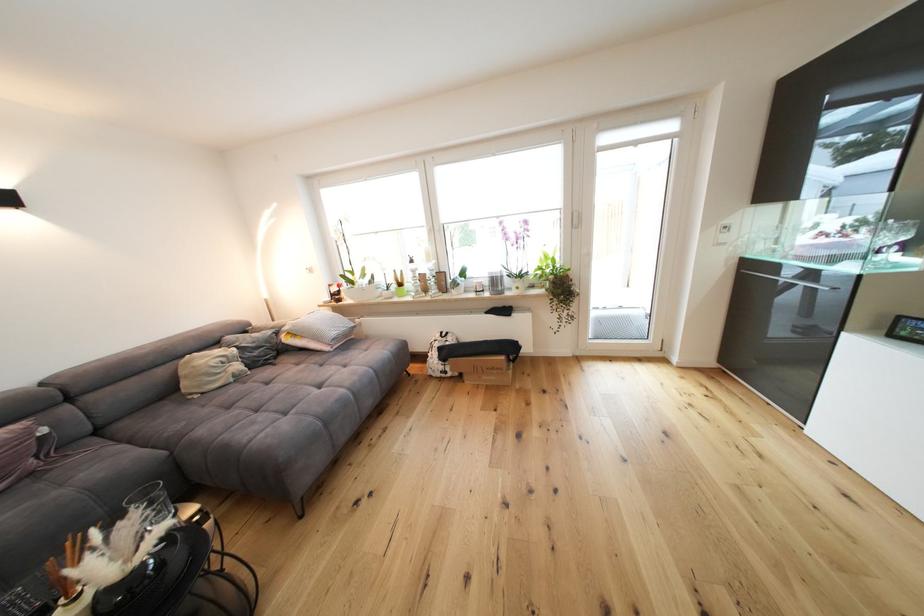
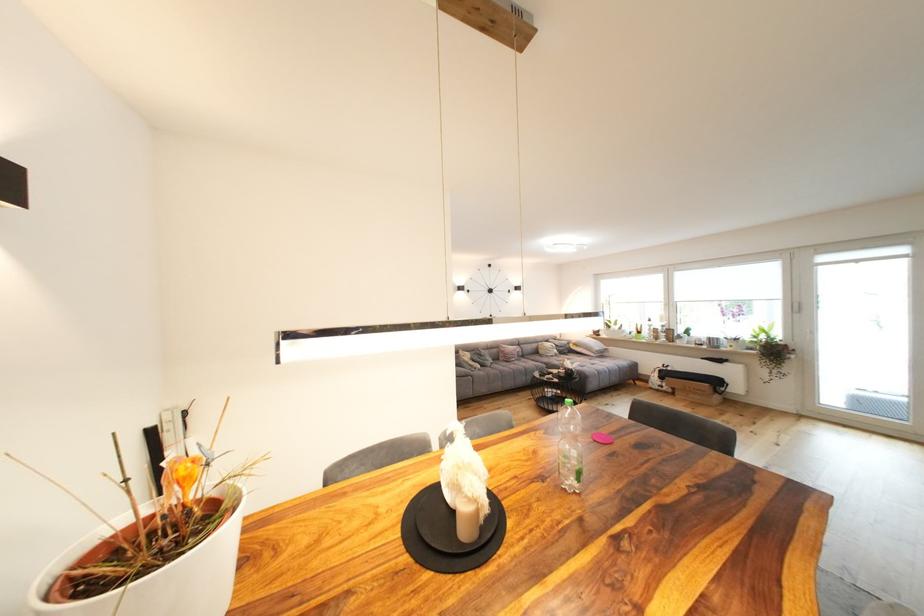
The point at (245, 369) is marked in the first image. Where is the corresponding point in the second image?

(563, 353)